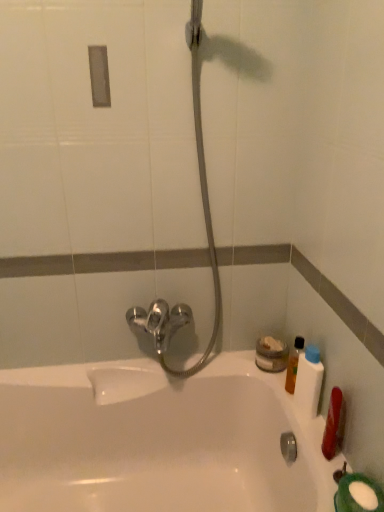
Question: Is translucent plastic bottle at right, which appears as the 1th mouthwash when viewed from the back, wider than white plastic bottle at right, arranged as the 1th mouthwash when viewed from the front?

Choices:
 (A) yes
 (B) no

Answer: (B)

Question: Is translucent plastic bottle at right, which appears as the 1th mouthwash when viewed from the back, to the left of white plastic bottle at right, the second mouthwash from the back, from the viewer's perspective?

Choices:
 (A) yes
 (B) no

Answer: (A)

Question: From a real-world perspective, is translucent plastic bottle at right, which appears as the 1th mouthwash when viewed from the back, positioned under white plastic bottle at right, arranged as the 1th mouthwash when viewed from the front, based on gravity?

Choices:
 (A) no
 (B) yes

Answer: (B)

Question: Is white plastic bottle at right, arranged as the 1th mouthwash when viewed from the front, inside translucent plastic bottle at right, which appears as the 1th mouthwash when viewed from the back?

Choices:
 (A) yes
 (B) no

Answer: (B)

Question: Is translucent plastic bottle at right, marked as the 2th mouthwash in a front-to-back arrangement, not inside white plastic bottle at right, arranged as the 1th mouthwash when viewed from the front?

Choices:
 (A) no
 (B) yes

Answer: (B)

Question: Can you confirm if translucent plastic bottle at right, which appears as the 1th mouthwash when viewed from the back, is shorter than white plastic bottle at right, the second mouthwash from the back?

Choices:
 (A) yes
 (B) no

Answer: (A)

Question: Is white glossy bathtub at center to the right of white plastic bottle at right, arranged as the 1th mouthwash when viewed from the front, from the viewer's perspective?

Choices:
 (A) no
 (B) yes

Answer: (A)

Question: From the image's perspective, is white glossy bathtub at center above white plastic bottle at right, the second mouthwash from the back?

Choices:
 (A) yes
 (B) no

Answer: (B)

Question: Is white glossy bathtub at center bigger than white plastic bottle at right, the second mouthwash from the back?

Choices:
 (A) yes
 (B) no

Answer: (A)

Question: Considering the relative positions of white glossy bathtub at center and white plastic bottle at right, the second mouthwash from the back, in the image provided, is white glossy bathtub at center in front of white plastic bottle at right, the second mouthwash from the back,?

Choices:
 (A) yes
 (B) no

Answer: (A)

Question: Does white glossy bathtub at center have a greater width compared to white plastic bottle at right, arranged as the 1th mouthwash when viewed from the front?

Choices:
 (A) no
 (B) yes

Answer: (B)

Question: Is white glossy bathtub at center smaller than white plastic bottle at right, arranged as the 1th mouthwash when viewed from the front?

Choices:
 (A) yes
 (B) no

Answer: (B)

Question: Considering the relative positions of translucent plastic bottle at right, which appears as the 1th mouthwash when viewed from the back, and white glossy bathtub at center in the image provided, is translucent plastic bottle at right, which appears as the 1th mouthwash when viewed from the back, to the right of white glossy bathtub at center from the viewer's perspective?

Choices:
 (A) no
 (B) yes

Answer: (B)